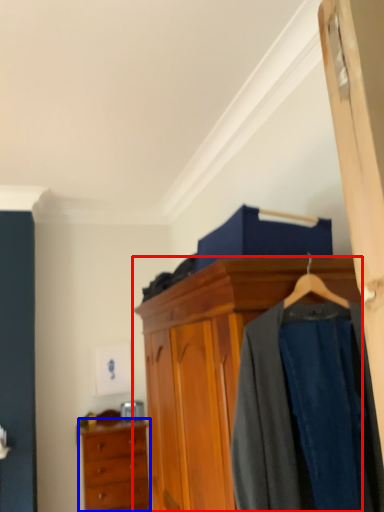
Question: Which of the following is the closest to the observer, cabinetry (highlighted by a red box) or chest of drawers (highlighted by a blue box)?

Choices:
 (A) cabinetry
 (B) chest of drawers

Answer: (A)